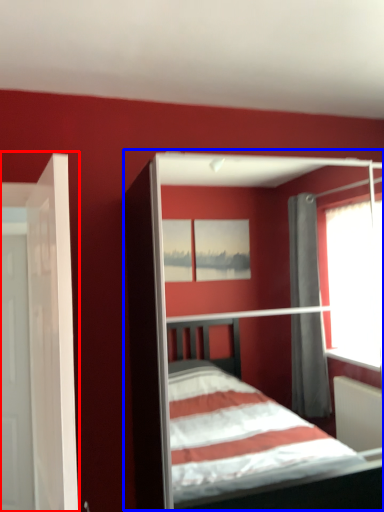
Question: Which object is further to the camera taking this photo, door (highlighted by a red box) or bed (highlighted by a blue box)?

Choices:
 (A) door
 (B) bed

Answer: (B)